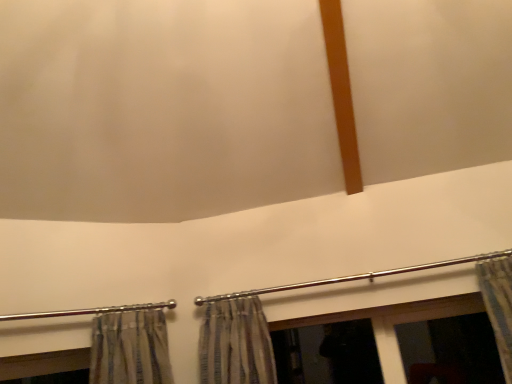
Question: Should I look upward or downward to see polished metal rod at center, marked as the first clothesline in a right-to-left arrangement?

Choices:
 (A) up
 (B) down

Answer: (B)

Question: Does polished metal rod at lower left, placed as the 2th clothesline when sorted from right to left, have a larger size compared to polished metal rod at center, placed as the second clothesline when sorted from left to right?

Choices:
 (A) no
 (B) yes

Answer: (B)

Question: From the image's perspective, is polished metal rod at lower left, which is the first clothesline from left to right, located beneath polished metal rod at center, marked as the first clothesline in a right-to-left arrangement?

Choices:
 (A) yes
 (B) no

Answer: (A)

Question: Does polished metal rod at lower left, which is the first clothesline from left to right, have a greater height compared to polished metal rod at center, marked as the first clothesline in a right-to-left arrangement?

Choices:
 (A) yes
 (B) no

Answer: (A)

Question: Considering the relative sizes of polished metal rod at lower left, which is the first clothesline from left to right, and polished metal rod at center, marked as the first clothesline in a right-to-left arrangement, in the image provided, is polished metal rod at lower left, which is the first clothesline from left to right, thinner than polished metal rod at center, marked as the first clothesline in a right-to-left arrangement,?

Choices:
 (A) yes
 (B) no

Answer: (B)

Question: From a real-world perspective, does polished metal rod at lower left, placed as the 2th clothesline when sorted from right to left, stand above polished metal rod at center, placed as the second clothesline when sorted from left to right?

Choices:
 (A) yes
 (B) no

Answer: (B)

Question: Does polished metal rod at lower left, placed as the 2th clothesline when sorted from right to left, appear on the right side of polished metal rod at center, placed as the second clothesline when sorted from left to right?

Choices:
 (A) no
 (B) yes

Answer: (A)

Question: Does polished metal rod at center, marked as the first clothesline in a right-to-left arrangement, have a smaller size compared to polished metal rod at lower left, which is the first clothesline from left to right?

Choices:
 (A) no
 (B) yes

Answer: (B)

Question: Is polished metal rod at center, placed as the second clothesline when sorted from left to right, looking in the opposite direction of polished metal rod at lower left, placed as the 2th clothesline when sorted from right to left?

Choices:
 (A) yes
 (B) no

Answer: (B)

Question: From the image's perspective, is polished metal rod at center, placed as the second clothesline when sorted from left to right, beneath polished metal rod at lower left, placed as the 2th clothesline when sorted from right to left?

Choices:
 (A) yes
 (B) no

Answer: (B)

Question: Can you confirm if polished metal rod at center, marked as the first clothesline in a right-to-left arrangement, is wider than polished metal rod at lower left, which is the first clothesline from left to right?

Choices:
 (A) no
 (B) yes

Answer: (A)

Question: Is polished metal rod at center, placed as the second clothesline when sorted from left to right, to the right of polished metal rod at lower left, which is the first clothesline from left to right, from the viewer's perspective?

Choices:
 (A) no
 (B) yes

Answer: (B)

Question: Is polished metal rod at center, marked as the first clothesline in a right-to-left arrangement, behind polished metal rod at lower left, which is the first clothesline from left to right?

Choices:
 (A) no
 (B) yes

Answer: (B)

Question: Considering the positions of polished metal rod at lower left, which is the first clothesline from left to right, and polished metal rod at center, marked as the first clothesline in a right-to-left arrangement, in the image, is polished metal rod at lower left, which is the first clothesline from left to right, wider or thinner than polished metal rod at center, marked as the first clothesline in a right-to-left arrangement,?

Choices:
 (A) thin
 (B) wide

Answer: (B)